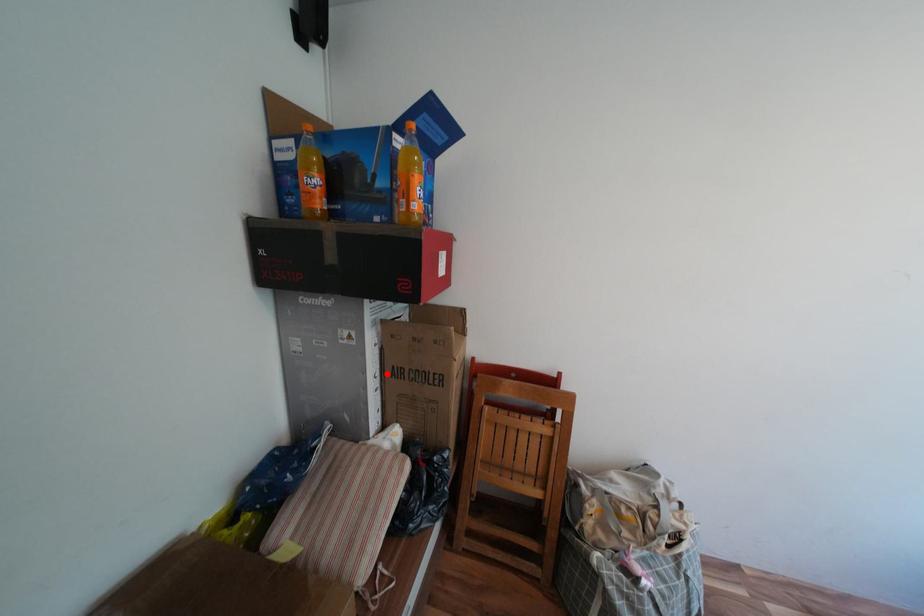
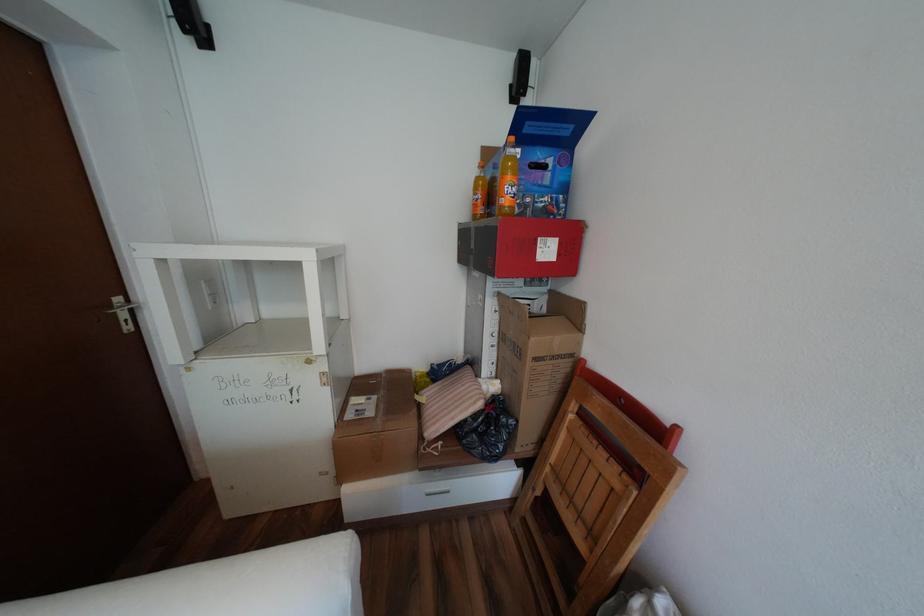
The point at the highlighted location is marked in the first image. Where is the corresponding point in the second image?

(505, 334)